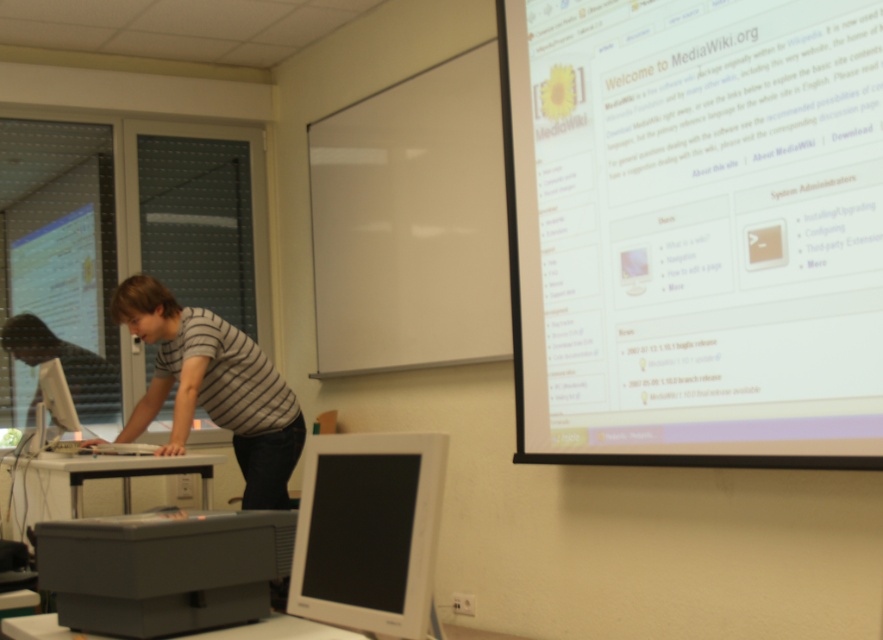
Question: Does white glossy projector screen at upper right have a lesser width compared to matte gray monitor at left?

Choices:
 (A) no
 (B) yes

Answer: (A)

Question: Among these points, which one is farthest from the camera?

Choices:
 (A) (416, 474)
 (B) (228, 612)

Answer: (B)

Question: Does white glossy projector screen at upper right have a lesser width compared to white plastic monitor at center?

Choices:
 (A) yes
 (B) no

Answer: (B)

Question: Which object appears closest to the camera in this image?

Choices:
 (A) matte gray monitor at left
 (B) white glossy projector screen at upper right
 (C) white plastic monitor at center
 (D) striped shirt at left

Answer: (C)

Question: Is striped fabric shirt at center behind striped shirt at left?

Choices:
 (A) no
 (B) yes

Answer: (A)

Question: Estimate the real-world distances between objects in this image. Which object is closer to the striped shirt at left?

Choices:
 (A) matte gray monitor at left
 (B) matte gray printer at lower left

Answer: (A)